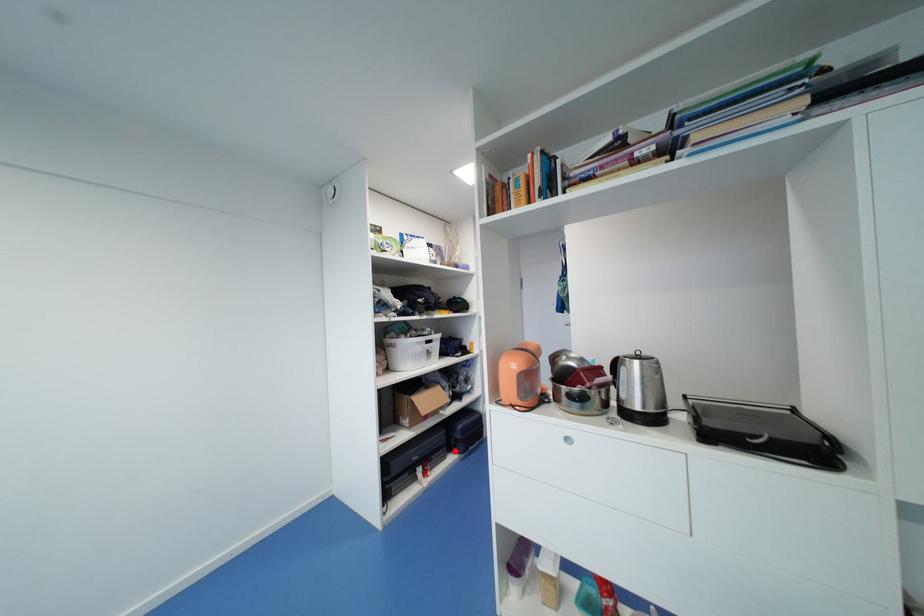
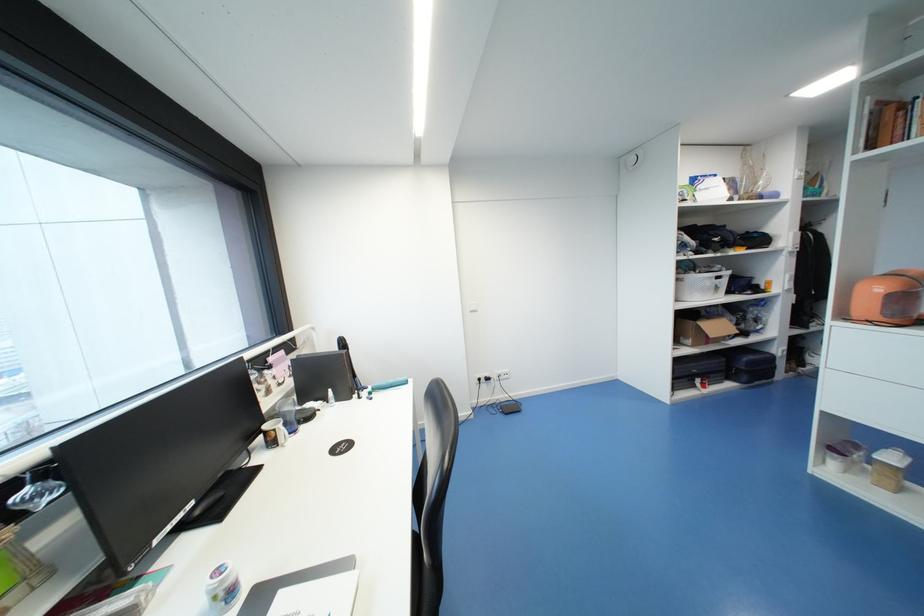
Locate, in the second image, the point that corresponds to the highlighted location in the first image.

(733, 379)